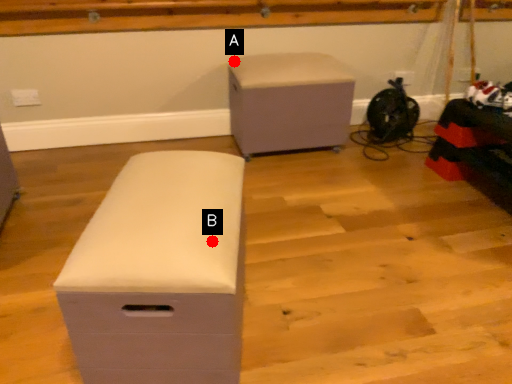
Question: Two points are circled on the image, labeled by A and B beside each circle. Which point is closer to the camera taking this photo?

Choices:
 (A) A is closer
 (B) B is closer

Answer: (B)